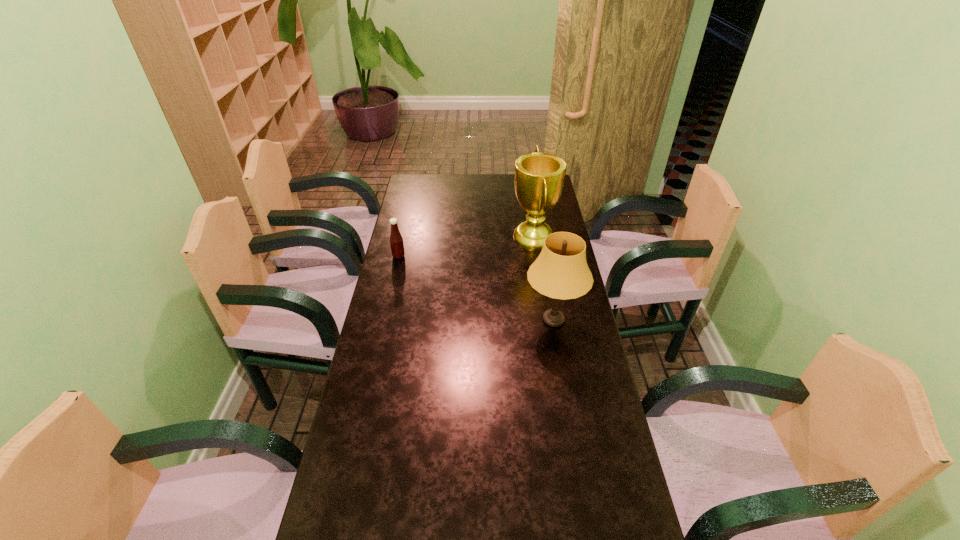
Find the location of a particular element. award is located at coordinates (539, 177).

Identify the location of the nearest object. The height and width of the screenshot is (540, 960). (560, 272).

You are a GUI agent. You are given a task and a screenshot of the screen. Output one action in this format:
    pyautogui.click(x=<x>, y=<y>)
    Task: Click on the Tabasco sauce
    The width and height of the screenshot is (960, 540).
    Given the screenshot: What is the action you would take?
    pyautogui.click(x=396, y=241)

This screenshot has width=960, height=540. What are the coordinates of `the shortest object` in the screenshot? It's located at (396, 241).

Where is `free space located on the shiny surface of the award`? free space located on the shiny surface of the award is located at coordinates (423, 237).

Image resolution: width=960 pixels, height=540 pixels. What are the coordinates of `free region located 0.180m on the shiny surface of the award` in the screenshot? It's located at (468, 237).

This screenshot has width=960, height=540. In order to click on vacant space located on the shiny surface of the award in this screenshot , I will do 499,237.

The height and width of the screenshot is (540, 960). Identify the location of vacant space located on the back of the lampshade. (548, 287).

Identify the location of vacant space located 0.130m on the front of the leftmost object. This screenshot has height=540, width=960. (393, 282).

Find the location of a particular element. object located at the left edge is located at coordinates (396, 241).